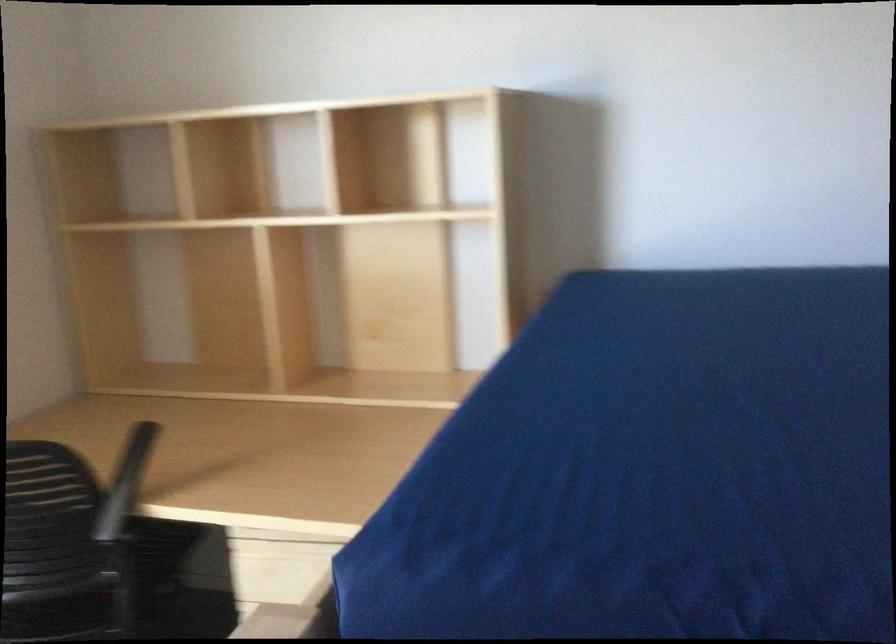
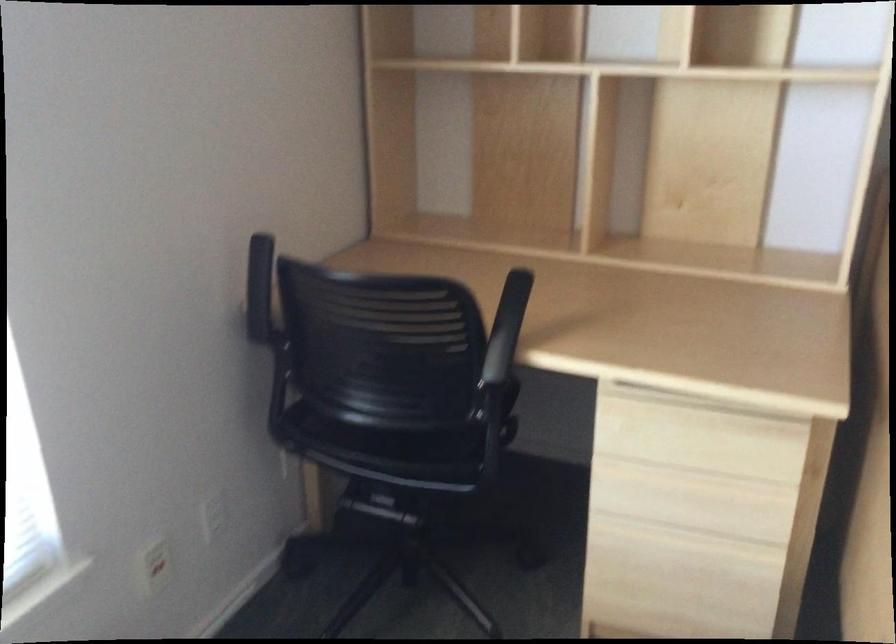
Question: The images are taken continuously from a first-person perspective. In which direction is your viewpoint rotating?

Choices:
 (A) Left
 (B) Right
 (C) Up
 (D) Down

Answer: (D)